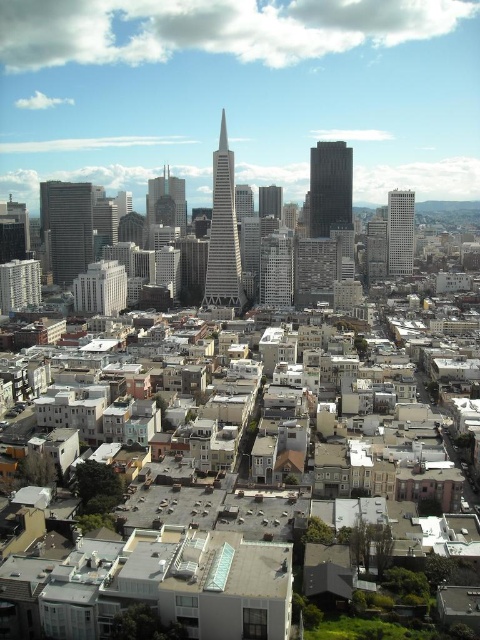
You are a drone operator flying a drone over the city. You need to capture a photo of the black glass skyscraper at center without the dark gray concrete skyscraper at left blocking it. Is this possible given their current positions?

The black glass skyscraper at center is behind the dark gray concrete skyscraper at left, so it is currently blocked. To capture a clear photo, you would need to adjust your position or angle to ensure the dark gray concrete skyscraper at left is not obstructing the view of the black glass skyscraper at center.

You are a drone operator tasked with navigating between two skyscrapers in the city. You need to fly your drone from the dark gray concrete skyscraper at left to the black glass skyscraper at center. According to the image, which direction should you fly the drone to reach your destination?

The dark gray concrete skyscraper at left is positioned on the left side of the black glass skyscraper at center, so you should fly the drone to the right to reach the black glass skyscraper at center from the dark gray concrete skyscraper at left.

You are a drone operator flying over the city. Your drone is currently above the dark gray concrete skyscraper at left and the smooth glass skyscraper at center. If you look downward, which skyscraper will appear larger in your camera view?

The dark gray concrete skyscraper at left appears larger in the camera view because it is positioned closer to the drone than the smooth glass skyscraper at center, which is farther away.